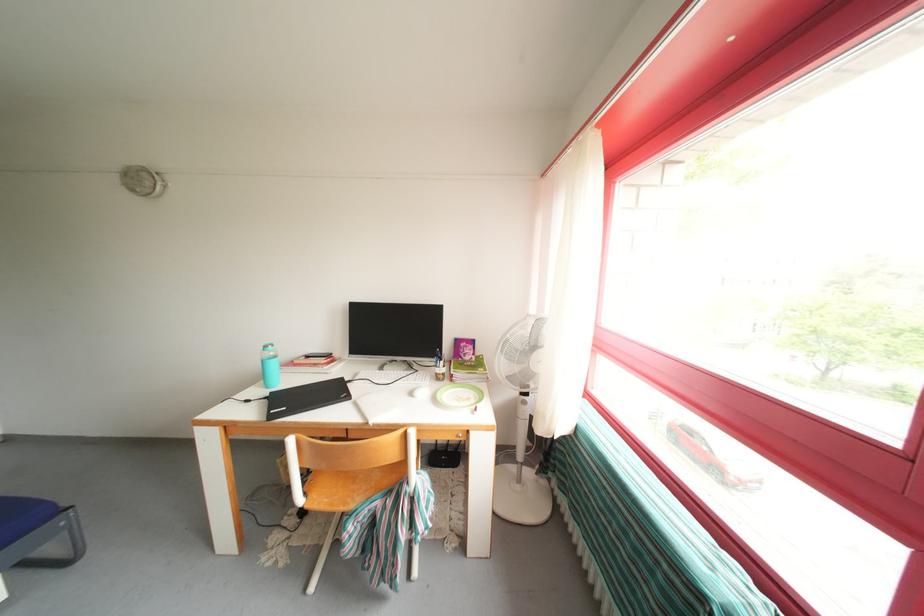
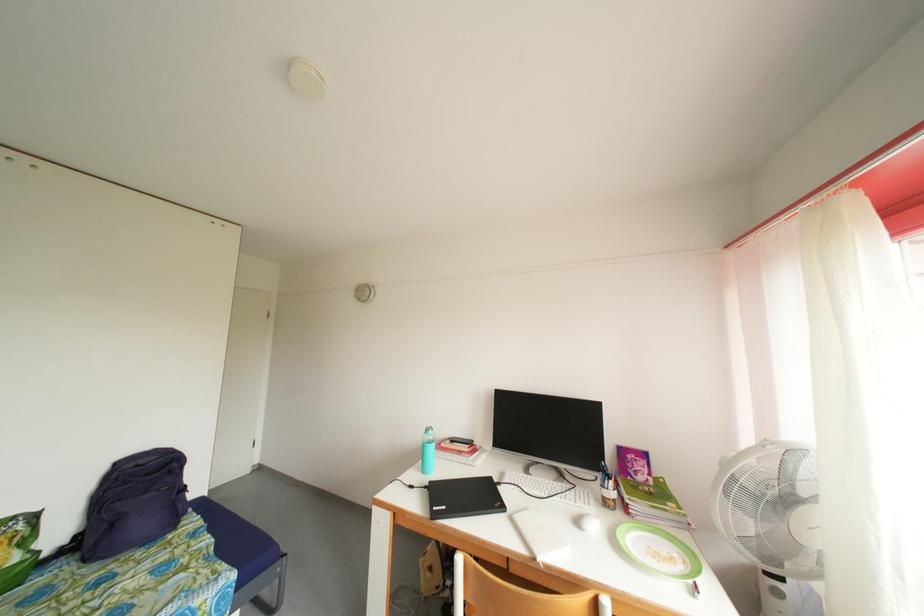
Question: Which direction would the cameraman need to move to produce the second image? Reply with the corresponding letter.

Choices:
 (A) Left
 (B) Right
 (C) Forward
 (D) Backward

Answer: (A)